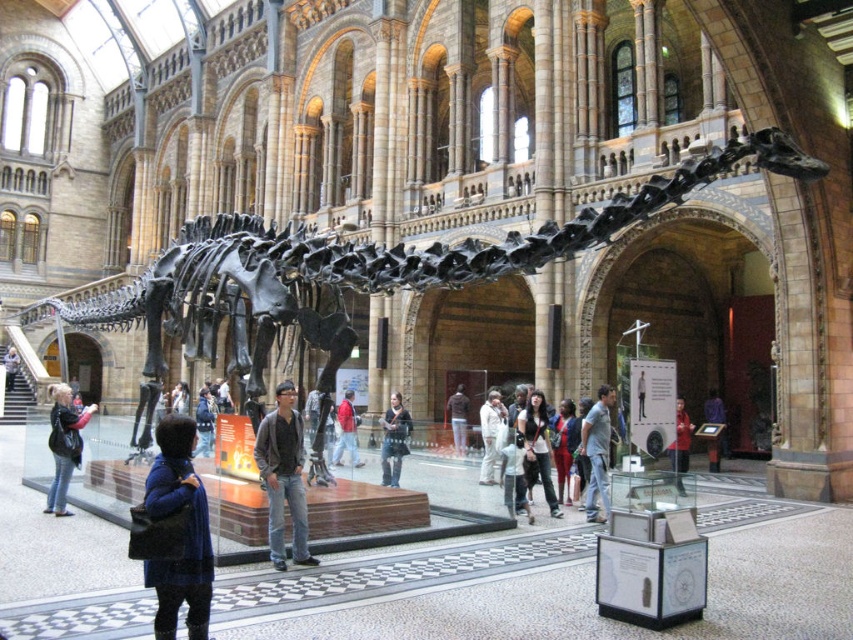
Does dark gray jeans at center have a lesser width compared to red fabric jacket at center?

Yes.

Locate an element on the screen. This screenshot has width=853, height=640. dark gray jeans at center is located at coordinates (283, 476).

Does point (65, 508) come behind point (538, 417)?

No, (65, 508) is closer to viewer.

Looking at this image, does denim jacket at lower left appear under dark brown leather jacket at center?

Correct, denim jacket at lower left is located below dark brown leather jacket at center.

Does point (48, 509) come farther from viewer compared to point (538, 390)?

That is False.

Image resolution: width=853 pixels, height=640 pixels. What are the coordinates of `denim jacket at lower left` in the screenshot? It's located at (64, 444).

Can you confirm if dark gray jeans at center is positioned to the right of dark gray sweater at center?

No, dark gray jeans at center is not to the right of dark gray sweater at center.

Is dark gray jeans at center below dark gray sweater at center?

No.

What do you see at coordinates (283, 476) in the screenshot?
I see `dark gray jeans at center` at bounding box center [283, 476].

What are the coordinates of `dark gray jeans at center` in the screenshot? It's located at (283, 476).